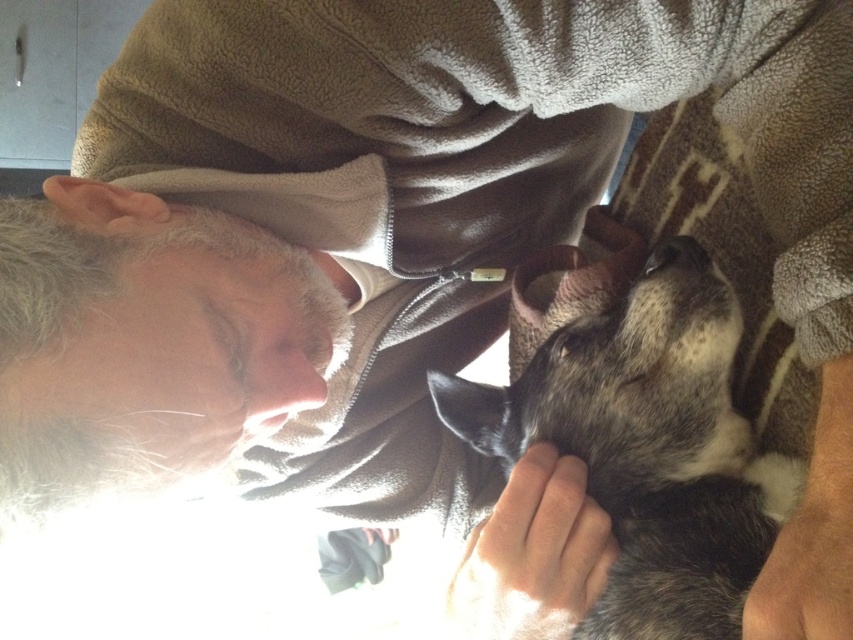
You are a photographer adjusting your camera settings to focus on two specific points in the scene. The first point is labeled as point (622, 572) and the second is point (242, 406). Since you can only focus on one point at a time, which point should you choose to ensure the foreground subject is in focus?

Point (622, 572) is closer to the camera than point (242, 406), so you should focus on point (622, 572) to ensure the foreground subject is in focus.

You are taking a photo of the speckled fur dog at center and the smooth skin nose at center. Which one will appear larger in the photo?

The speckled fur dog at center will appear larger in the photo because it is closer to the viewer than the smooth skin nose at center.